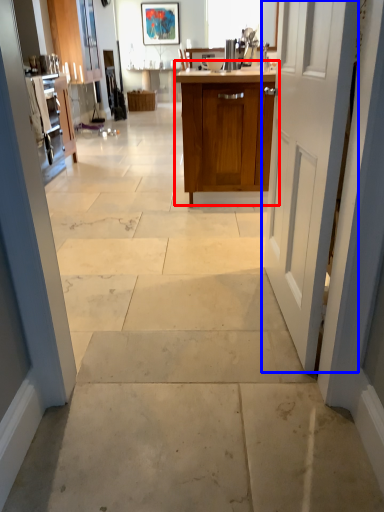
Question: Among these objects, which one is farthest to the camera, cabinetry (highlighted by a red box) or door (highlighted by a blue box)?

Choices:
 (A) cabinetry
 (B) door

Answer: (A)